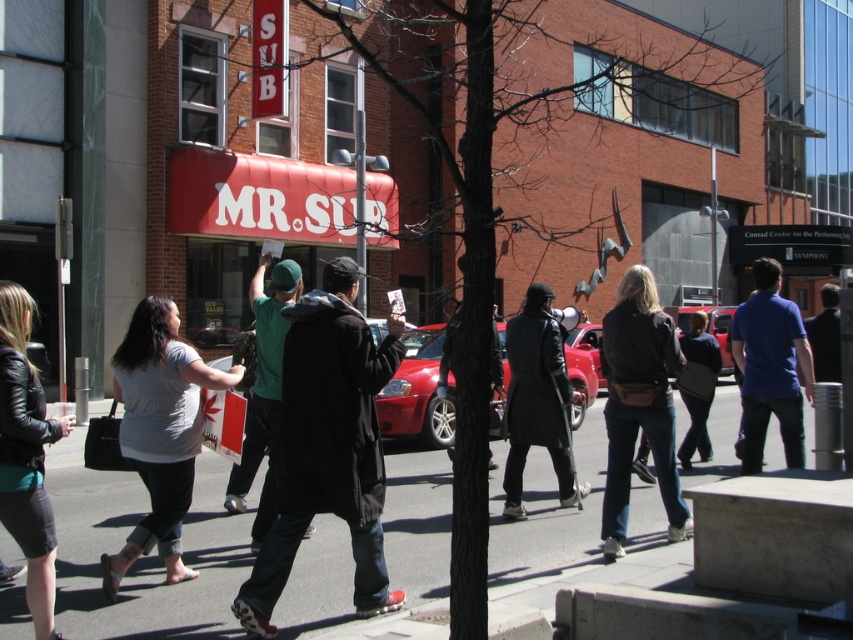
Is point (161, 433) positioned after point (798, 321)?

No, (161, 433) is in front of (798, 321).

Between light gray cotton shirt at lower left and blue cotton shirt at right, which one appears on the right side from the viewer's perspective?

blue cotton shirt at right

Between point (190, 486) and point (743, 332), which one is positioned in front?

Positioned in front is point (190, 486).

At what (x,y) coordinates should I click in order to perform the action: click on light gray cotton shirt at lower left. Please return your answer as a coordinate pair (x, y). Image resolution: width=853 pixels, height=640 pixels. Looking at the image, I should click on (160, 429).

Does dark brown leather jacket at center appear on the left side of leather jacket at left?

No, dark brown leather jacket at center is not to the left of leather jacket at left.

Is dark brown leather jacket at center taller than leather jacket at left?

Yes.

Locate an element on the screen. The width and height of the screenshot is (853, 640). dark brown leather jacket at center is located at coordinates (639, 404).

Can you confirm if smooth concrete pavement at center is bigger than black leather coat at center?

Correct, smooth concrete pavement at center is larger in size than black leather coat at center.

Who is more distant from viewer, (593,410) or (546,400)?

The point (593,410) is behind.

Where is `smooth concrete pavement at center`? This screenshot has height=640, width=853. smooth concrete pavement at center is located at coordinates (142, 557).